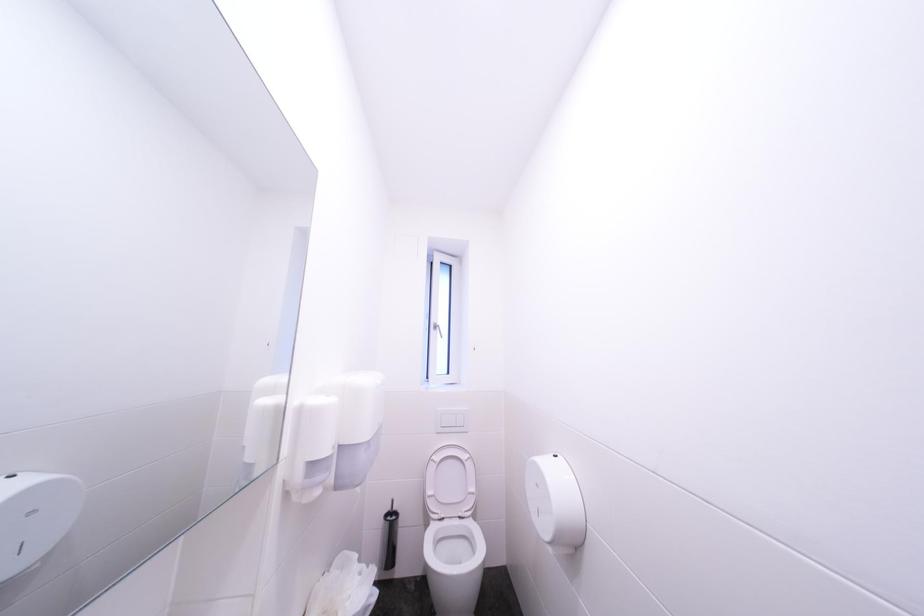
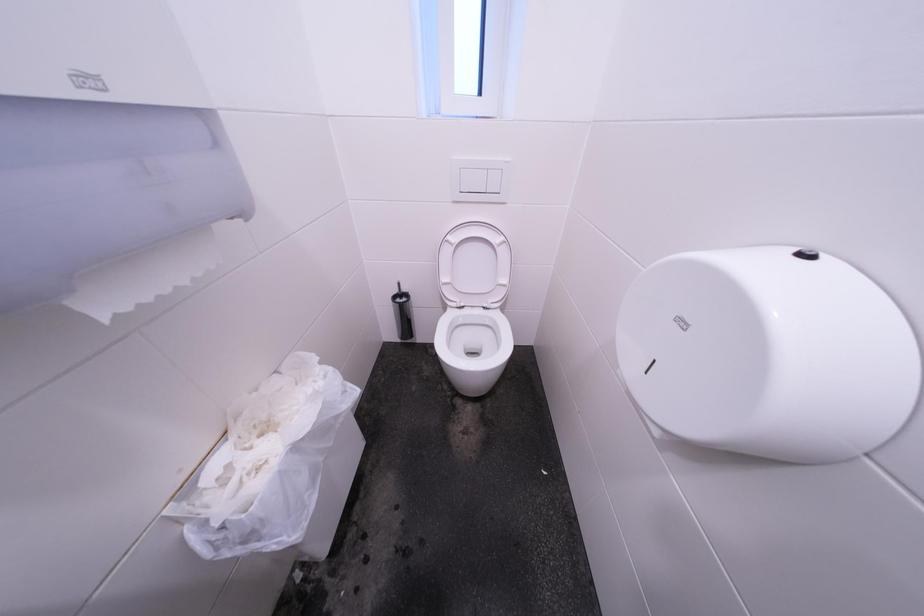
Question: Based on the continuous images, in which direction is the camera rotating? Reply with the corresponding letter.

Choices:
 (A) Left
 (B) Right
 (C) Up
 (D) Down

Answer: (D)